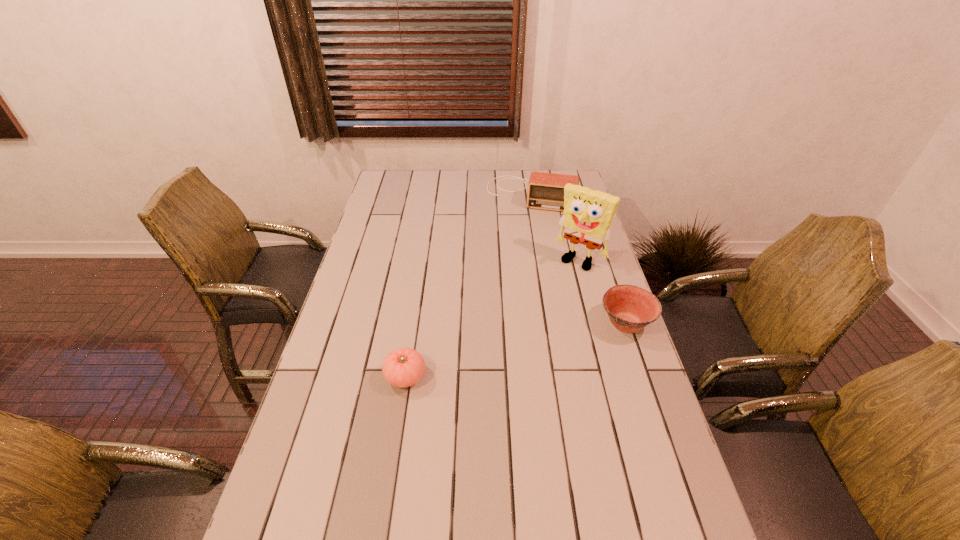
What are the coordinates of `free space on the desktop that is between the leftmost object and the bowl and is positioned on the front-facing side of the farthest object` in the screenshot? It's located at (492, 355).

The height and width of the screenshot is (540, 960). In order to click on free spot on the desktop that is between the tomato and the bowl and is positioned on the face of the sponge in this screenshot , I will do `click(515, 350)`.